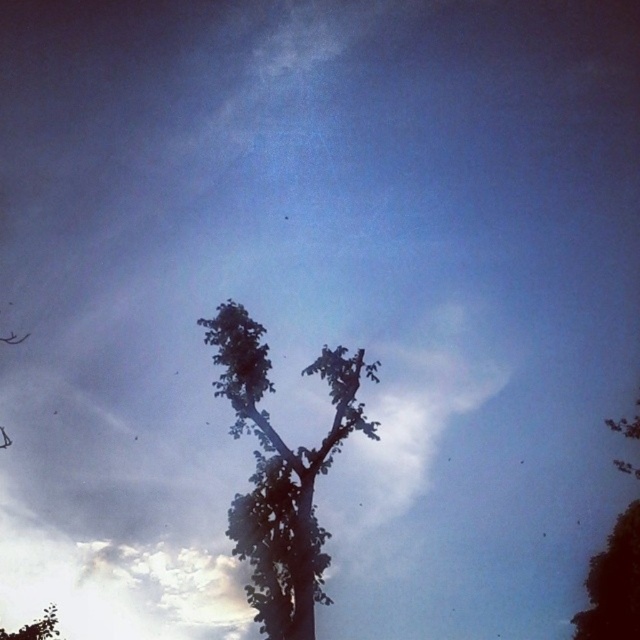
Question: Among these objects, which one is nearest to the camera?

Choices:
 (A) dark green leafy tree at center
 (B) green leafy tree at lower left
 (C) silhouette leafy tree at upper right

Answer: (A)

Question: Does dark green leafy tree at center have a larger size compared to green leafy tree at lower left?

Choices:
 (A) no
 (B) yes

Answer: (B)

Question: Which object is the farthest from the dark green leafy tree at center?

Choices:
 (A) green leafy tree at lower left
 (B) silhouette leafy tree at upper right

Answer: (A)

Question: Can you confirm if silhouette leafy tree at upper right is positioned to the left of green leafy tree at lower left?

Choices:
 (A) yes
 (B) no

Answer: (B)

Question: Which of the following is the farthest from the observer?

Choices:
 (A) (35, 627)
 (B) (630, 568)
 (C) (260, 384)

Answer: (A)

Question: Can you confirm if dark green leafy tree at center is positioned to the right of silhouette leafy tree at upper right?

Choices:
 (A) yes
 (B) no

Answer: (B)